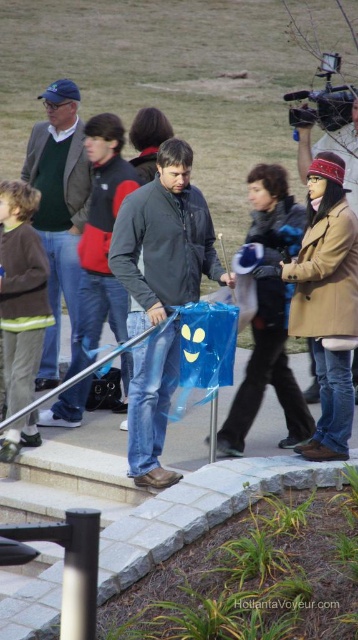
Question: Can you confirm if matte green sweater at upper left is positioned to the left of black plastic video camera at upper right?

Choices:
 (A) no
 (B) yes

Answer: (B)

Question: Is matte blue plastic bag at center below matte green sweater at upper left?

Choices:
 (A) yes
 (B) no

Answer: (A)

Question: Based on their relative distances, which object is nearer to the brown leather jacket at right?

Choices:
 (A) black plastic video camera at upper right
 (B) matte blue plastic bag at center

Answer: (A)

Question: Which of the following is the farthest from the observer?

Choices:
 (A) matte blue plastic bag at center
 (B) brown leather jacket at right

Answer: (B)

Question: Estimate the real-world distances between objects in this image. Which object is farther from the matte green sweater at upper left?

Choices:
 (A) matte blue plastic bag at center
 (B) brown leather jacket at right

Answer: (B)

Question: Considering the relative positions of brown leather jacket at right and black plastic video camera at upper right in the image provided, where is brown leather jacket at right located with respect to black plastic video camera at upper right?

Choices:
 (A) right
 (B) left

Answer: (B)